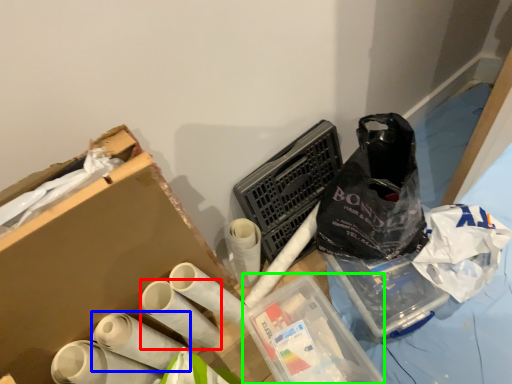
Question: Which object is positioned farthest from toilet paper (highlighted by a red box)? Select from toilet paper (highlighted by a blue box) and box (highlighted by a green box).

Choices:
 (A) toilet paper
 (B) box

Answer: (B)